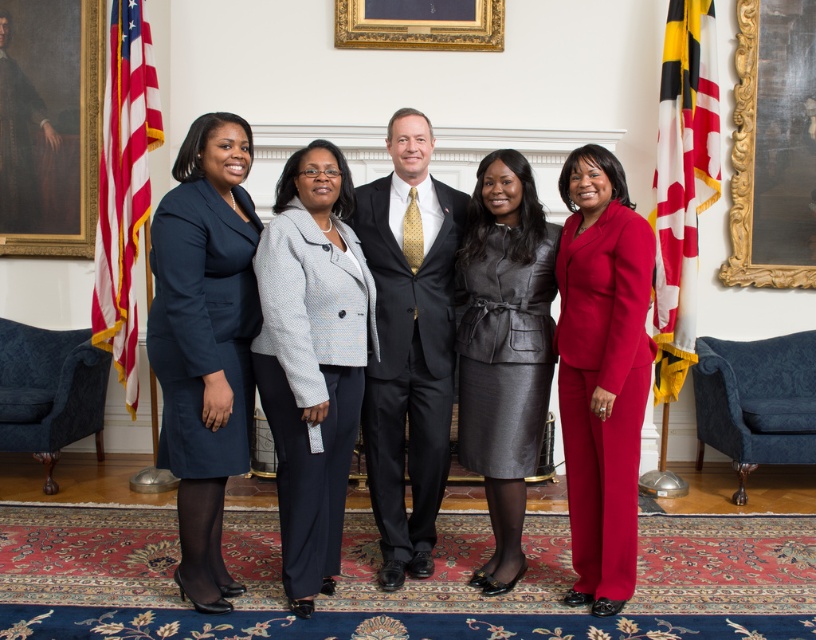
Question: Does matte navy coat at left appear on the left side of american flag at left?

Choices:
 (A) no
 (B) yes

Answer: (A)

Question: Which object is closer to the camera taking this photo?

Choices:
 (A) matte black suit at center
 (B) gold ornate picture frame at upper center

Answer: (A)

Question: Estimate the real-world distances between objects in this image. Which object is farther from the wooden portrait frame at left?

Choices:
 (A) black suit at center
 (B) matte red suit at right
 (C) matte black suit at center

Answer: (B)

Question: Does matte red suit at right lie in front of shiny black skirt at center?

Choices:
 (A) no
 (B) yes

Answer: (B)

Question: Does wooden portrait frame at left have a lesser width compared to gold ornate picture frame at upper center?

Choices:
 (A) no
 (B) yes

Answer: (B)

Question: Among these objects, which one is farthest from the camera?

Choices:
 (A) matte red suit at right
 (B) shiny black skirt at center
 (C) american flag at left
 (D) wooden portrait frame at left

Answer: (D)